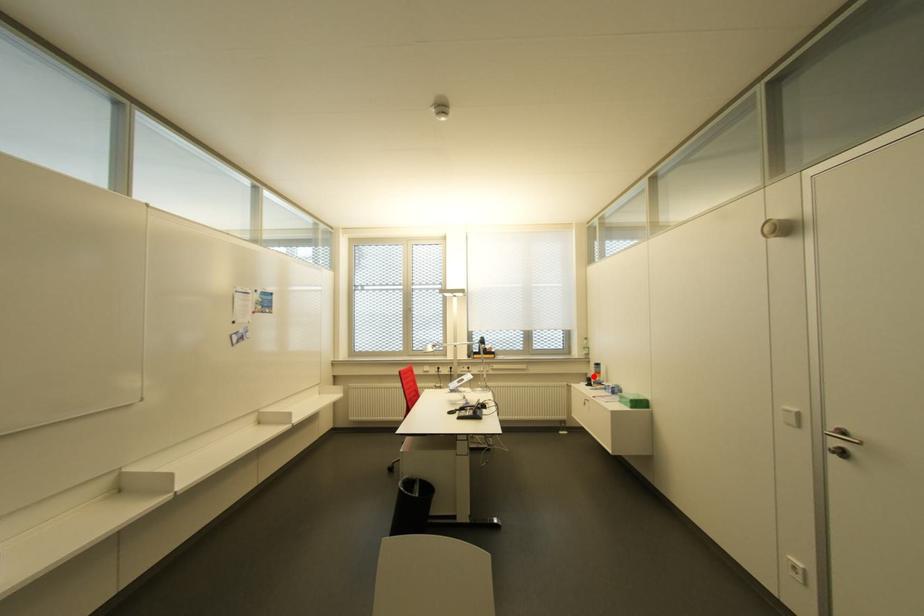
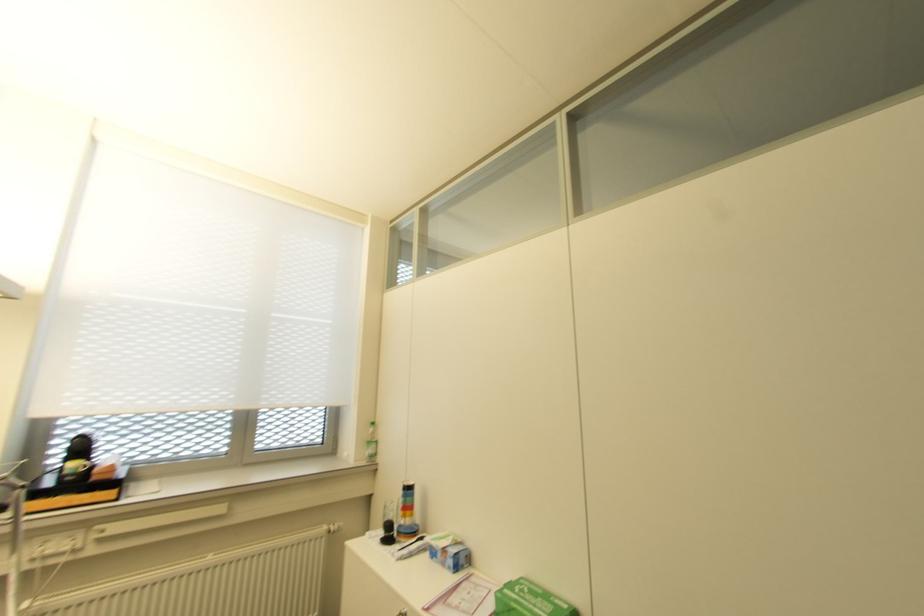
Find the pixel in the second image that matches the highlighted location in the first image.

(402, 517)